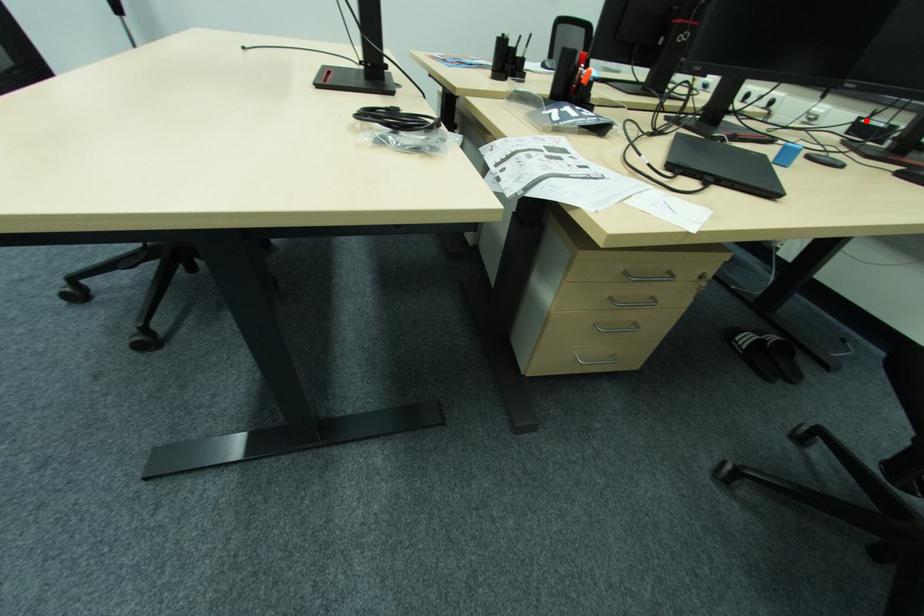
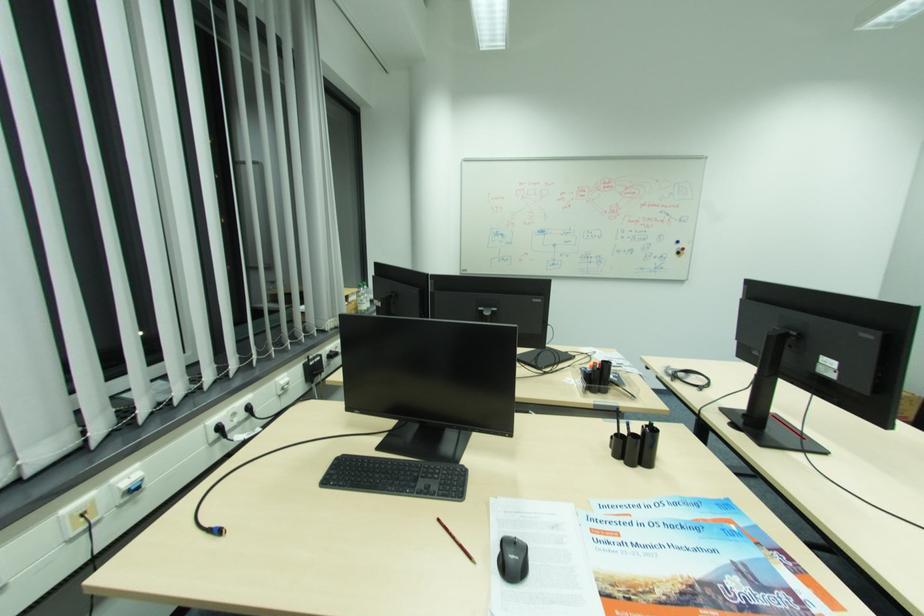
Question: I am providing you with two images of the same scene from different viewpoints. In image1, a red point is highlighted. Considering the same 3D point in image2, which of the following is correct?

Choices:
 (A) It is closer
 (B) It is farther

Answer: (A)